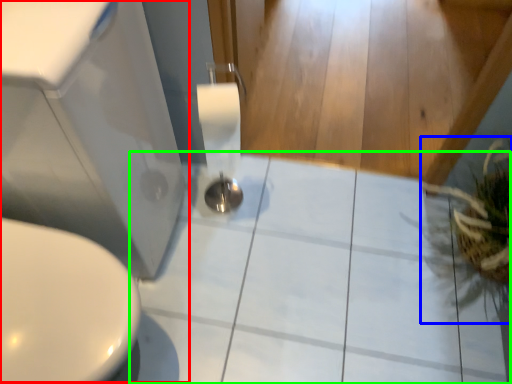
Question: Considering the real-world distances, which object is closest to sink (highlighted by a red box)? plant (highlighted by a blue box) or ceramic tile (highlighted by a green box).

Choices:
 (A) plant
 (B) ceramic tile

Answer: (B)